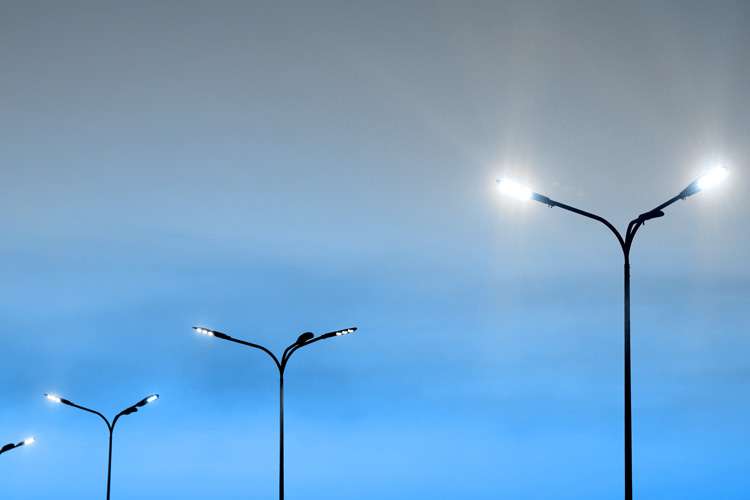
Identify the location of light. Image resolution: width=750 pixels, height=500 pixels. (712, 177).